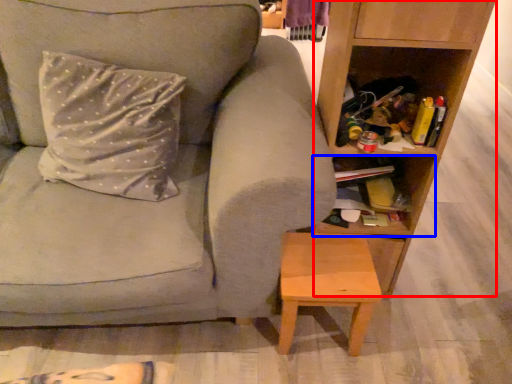
Question: Which object appears closest to the camera in this image, shelf (highlighted by a red box) or cabinet (highlighted by a blue box)?

Choices:
 (A) shelf
 (B) cabinet

Answer: (A)